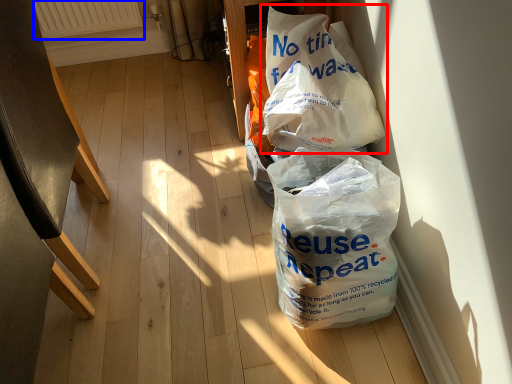
Question: Which object appears farthest to the camera in this image, plastic bag (highlighted by a red box) or radiator (highlighted by a blue box)?

Choices:
 (A) plastic bag
 (B) radiator

Answer: (B)